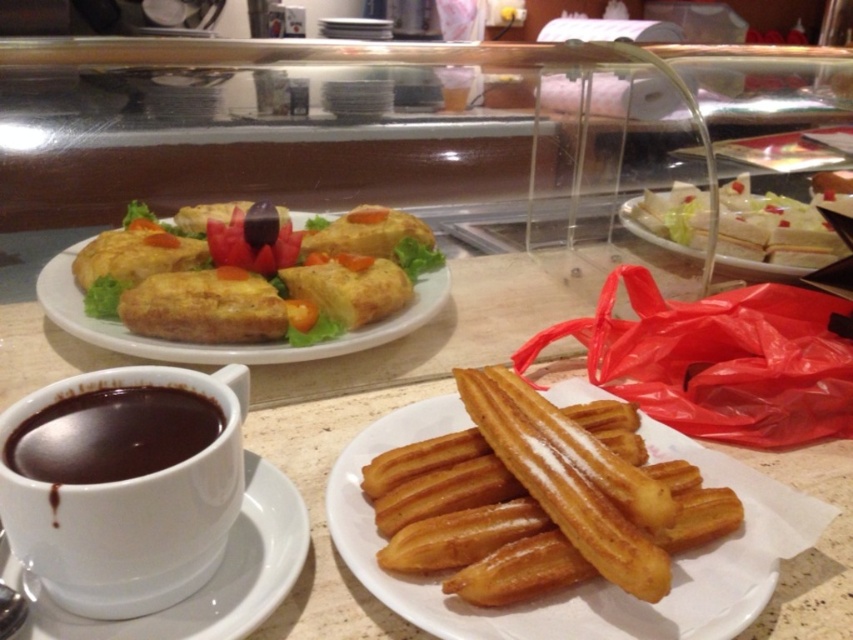
The height and width of the screenshot is (640, 853). What do you see at coordinates (380, 416) in the screenshot?
I see `satin white plate at center` at bounding box center [380, 416].

Is point (277, 627) positioned behind point (717, 492)?

That is False.

Between point (850, 618) and point (397, 538), which one is positioned behind?

Point (397, 538)

Find the location of a particular element. satin white plate at center is located at coordinates (380, 416).

Who is more forward, (474,586) or (57,403)?

Point (474,586) is more forward.

Who is shorter, golden fried churros at center or dark chocolate cup at lower left?

dark chocolate cup at lower left is shorter.

Based on the photo, who is more distant from viewer, [396,531] or [6,465]?

The point [396,531] is behind.

Identify the location of golden fried churros at center. pos(540,499).

Identify the location of satin white plate at center. The image size is (853, 640). (380, 416).

What are the coordinates of `satin white plate at center` in the screenshot? It's located at (380, 416).